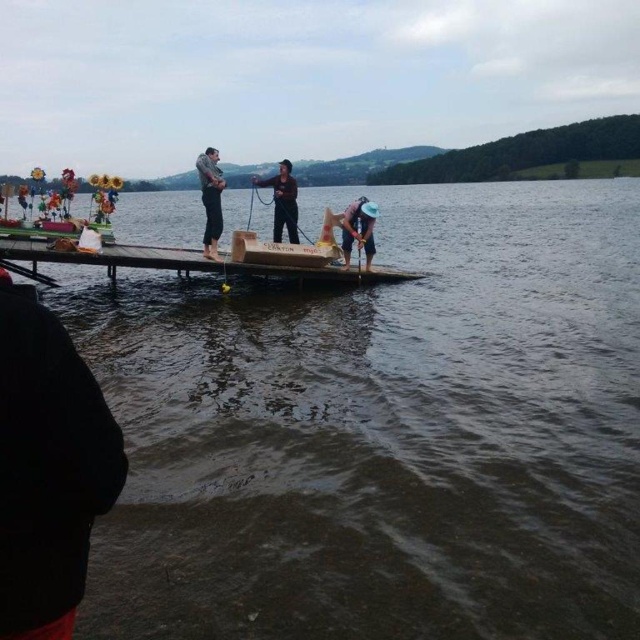
Is black matte shirt at center further to the viewer compared to blue fabric hat at lower right?

Yes, it is behind blue fabric hat at lower right.

In the scene shown: Can you confirm if black matte shirt at center is smaller than blue fabric hat at lower right?

No.

Between point (276, 208) and point (369, 212), which one is positioned in front?

Point (369, 212) is in front.

Where is `black matte shirt at center`? The image size is (640, 640). black matte shirt at center is located at coordinates (282, 200).

Which is in front, point (237, 269) or point (282, 163)?

Point (237, 269)

Which is behind, point (385, 268) or point (262, 182)?

The point (385, 268) is behind.

This screenshot has width=640, height=640. What are the coordinates of `wooden dock at center` in the screenshot? It's located at (195, 262).

Can you confirm if gray flannel shirt at center is bigger than black matte shirt at center?

No.

Who is positioned more to the right, gray flannel shirt at center or black matte shirt at center?

Positioned to the right is black matte shirt at center.

Where is `gray flannel shirt at center`? The width and height of the screenshot is (640, 640). gray flannel shirt at center is located at coordinates (211, 198).